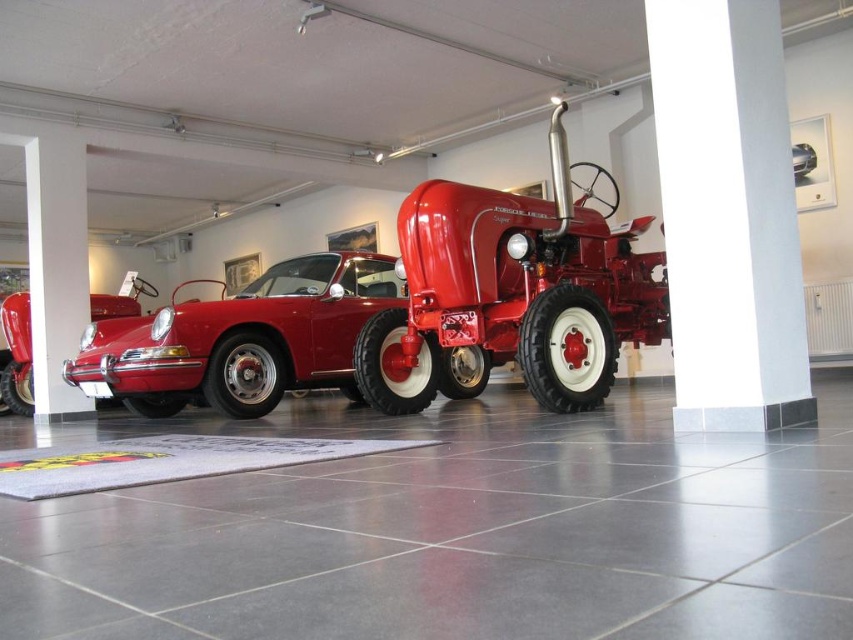
Question: Which object is the farthest from the glossy red car at left?

Choices:
 (A) glossy red car at center
 (B) glossy metallic car at center

Answer: (B)

Question: Considering the real-world distances, which object is closest to the glossy red car at center?

Choices:
 (A) glossy metallic car at center
 (B) glossy red car at left

Answer: (B)

Question: Does glossy red car at center appear on the right side of glossy red car at left?

Choices:
 (A) no
 (B) yes

Answer: (B)

Question: Which is nearer to the glossy red car at center?

Choices:
 (A) glossy red car at left
 (B) glossy metallic car at center

Answer: (A)

Question: Can you confirm if glossy red car at left is positioned to the left of glossy metallic car at center?

Choices:
 (A) no
 (B) yes

Answer: (B)

Question: Can you confirm if glossy red car at left is thinner than glossy metallic car at center?

Choices:
 (A) yes
 (B) no

Answer: (B)